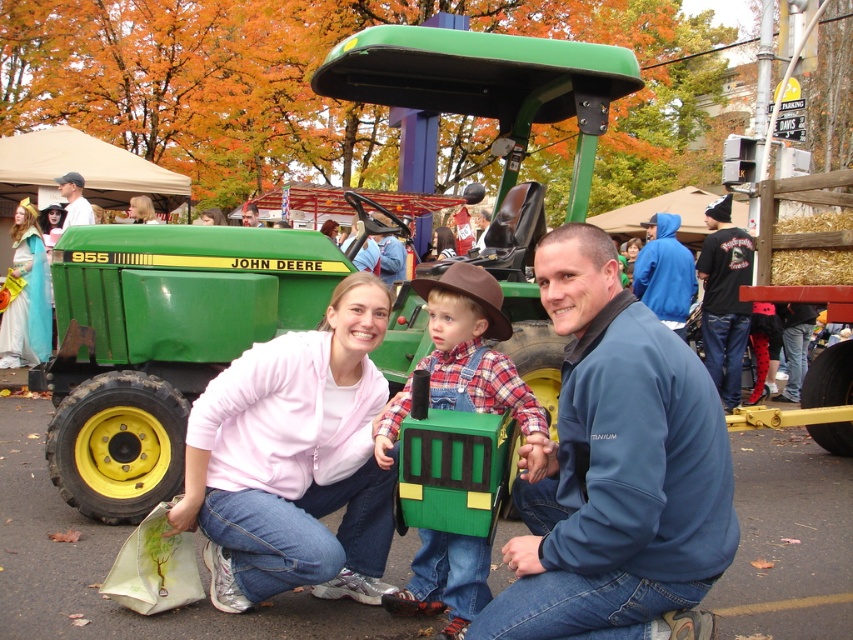
Based on the photo, can you confirm if blue fleece jacket at center is positioned to the left of blue fleece jacket at upper right?

Correct, you'll find blue fleece jacket at center to the left of blue fleece jacket at upper right.

Can you confirm if blue fleece jacket at center is wider than blue fleece jacket at upper right?

Incorrect, blue fleece jacket at center's width does not surpass blue fleece jacket at upper right's.

Looking at this image, who is more distant from viewer, (531, 616) or (675, 264)?

The point (675, 264) is more distant.

Where is `blue fleece jacket at center`? blue fleece jacket at center is located at coordinates (614, 467).

Does point (701, 449) lie behind point (257, 221)?

No, it is in front of (257, 221).

The height and width of the screenshot is (640, 853). What do you see at coordinates (614, 467) in the screenshot?
I see `blue fleece jacket at center` at bounding box center [614, 467].

You are a GUI agent. You are given a task and a screenshot of the screen. Output one action in this format:
    pyautogui.click(x=<x>, y=<y>)
    Task: Click on the blue fleece jacket at center
    
    Given the screenshot: What is the action you would take?
    pyautogui.click(x=614, y=467)

Is point (370, 216) in front of point (91, 212)?

Yes.

Is point (381, 253) behind point (79, 182)?

No, (381, 253) is in front of (79, 182).

The image size is (853, 640). Describe the element at coordinates (390, 257) in the screenshot. I see `matte blue shirt at center` at that location.

Identify the location of matte blue shirt at center. The width and height of the screenshot is (853, 640). (390, 257).